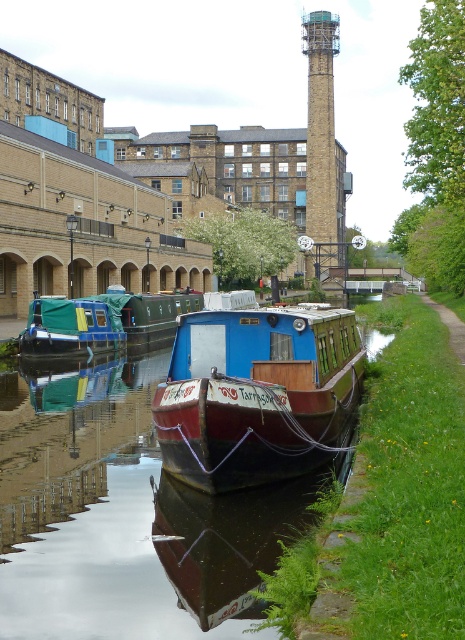
Image resolution: width=465 pixels, height=640 pixels. What do you see at coordinates (123, 518) in the screenshot?
I see `smooth dark water at center` at bounding box center [123, 518].

Who is taller, smooth dark water at center or teal fabric-covered boat at center?

teal fabric-covered boat at center is taller.

Who is more forward, (123, 497) or (191, 292)?

Point (123, 497) is more forward.

This screenshot has width=465, height=640. I want to click on smooth dark water at center, so click(x=123, y=518).

Is maroon wooden boat at center shorter than teal fabric-covered boat at center?

Incorrect, maroon wooden boat at center's height does not fall short of teal fabric-covered boat at center's.

Who is lower down, maroon wooden boat at center or teal fabric-covered boat at center?

maroon wooden boat at center is lower down.

Which is behind, point (258, 433) or point (151, 301)?

Positioned behind is point (151, 301).

At what (x,y) coordinates should I click in order to perform the action: click on maroon wooden boat at center. Please return your answer as a coordinate pair (x, y). Looking at the image, I should click on (256, 392).

Can you confirm if smooth dark water at center is taller than green canvas boat at center?

Incorrect, smooth dark water at center's height is not larger of green canvas boat at center's.

Which is more to the left, smooth dark water at center or green canvas boat at center?

Positioned to the left is green canvas boat at center.

Between point (191, 577) and point (87, 321), which one is positioned in front?

Point (191, 577) is more forward.

The height and width of the screenshot is (640, 465). Find the location of `smooth dark water at center`. smooth dark water at center is located at coordinates (123, 518).